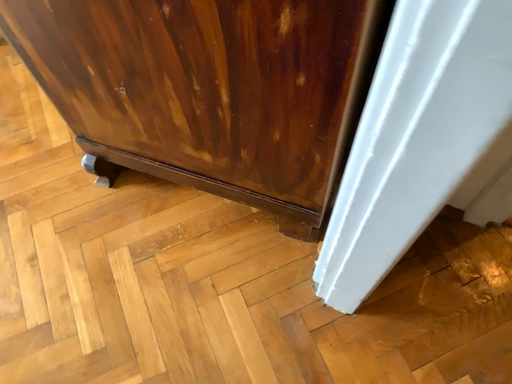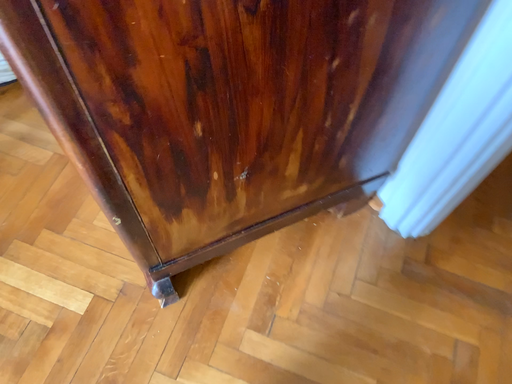
Question: How did the camera likely rotate when shooting the video?

Choices:
 (A) rotated upward
 (B) rotated downward

Answer: (A)